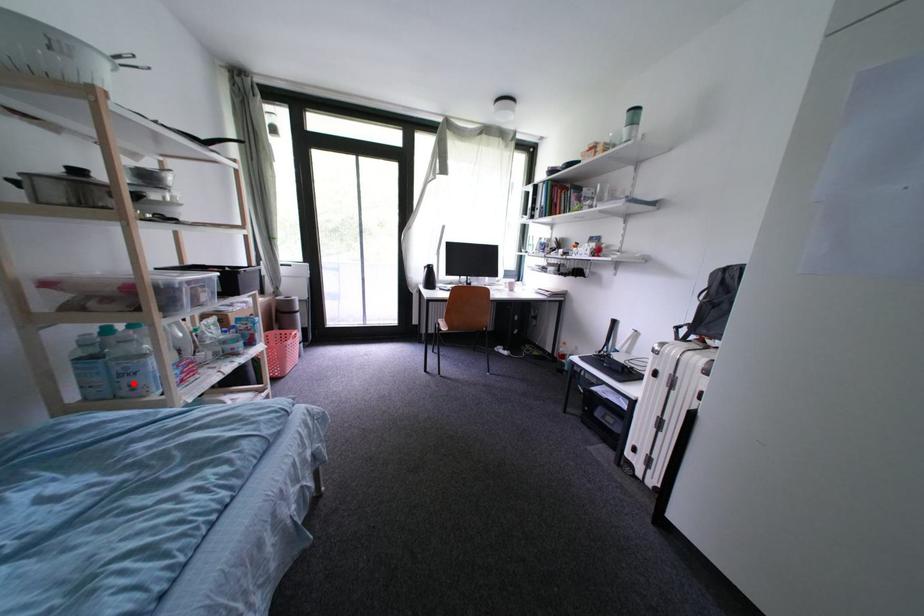
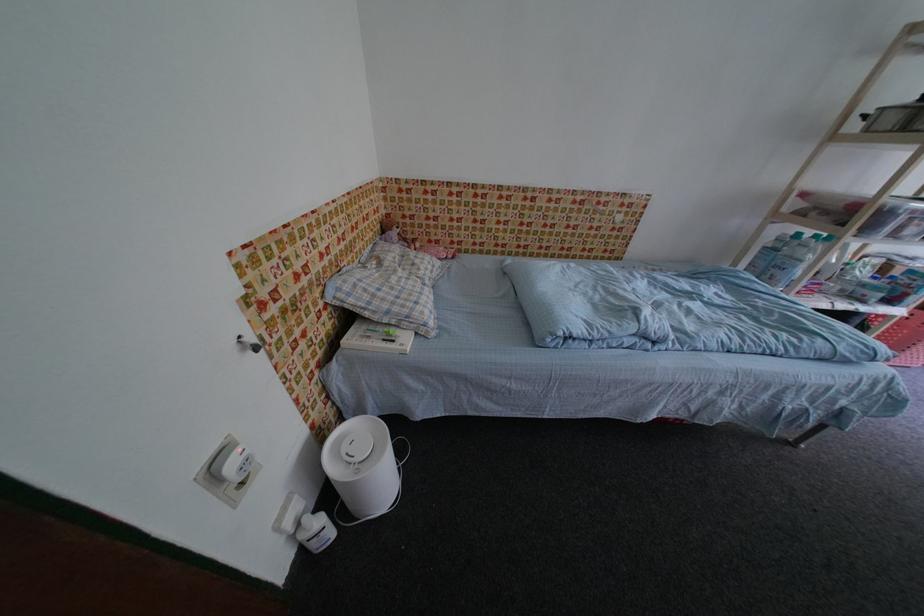
Locate, in the second image, the point that corresponds to the highlighted location in the first image.

(782, 274)